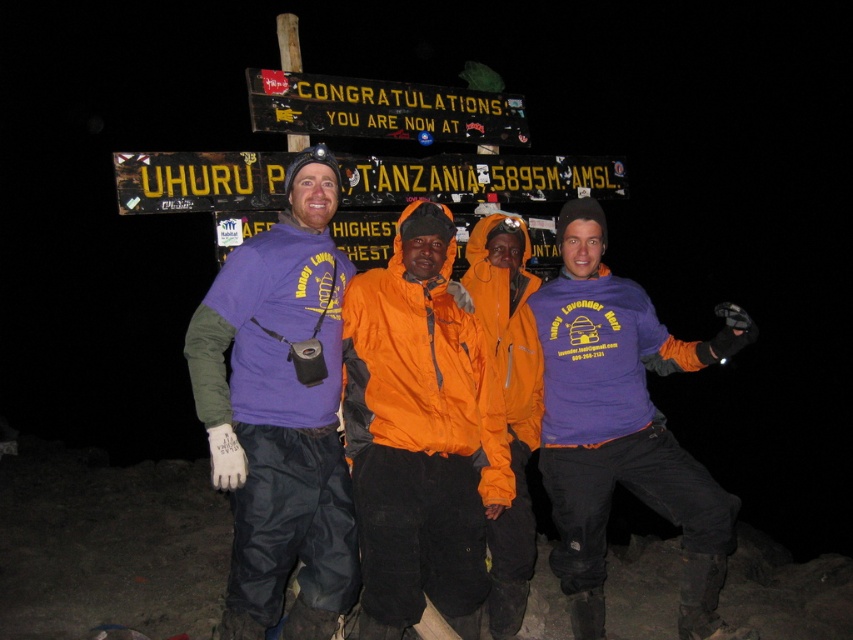
Is orange waterproof jacket at center smaller than purple fleece jacket at center?

Yes, orange waterproof jacket at center is smaller than purple fleece jacket at center.

Where is `orange waterproof jacket at center`? The width and height of the screenshot is (853, 640). orange waterproof jacket at center is located at coordinates (421, 433).

The width and height of the screenshot is (853, 640). What are the coordinates of `orange waterproof jacket at center` in the screenshot? It's located at (421, 433).

Between point (303, 362) and point (567, 564), which one is positioned behind?

The point (567, 564) is more distant.

Is point (293, 332) behind point (621, 481)?

No, (293, 332) is closer to viewer.

Between point (277, 429) and point (566, 394), which one is positioned behind?

Positioned behind is point (566, 394).

Identify the location of purple fabric shirt at center. (280, 412).

Measure the distance between point (305, 202) and camera.

Point (305, 202) is 3.41 meters from camera.

Is point (310, 148) behind point (438, 259)?

That is False.

Is point (260, 608) closer to camera compared to point (460, 422)?

Yes, it is.

Locate an element on the screen. Image resolution: width=853 pixels, height=640 pixels. purple fabric shirt at center is located at coordinates (280, 412).